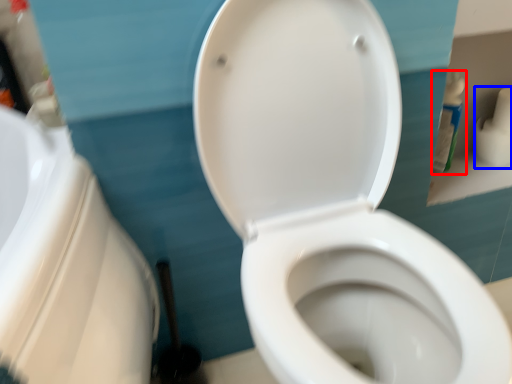
Question: Which object appears farthest to the camera in this image, cleaning product (highlighted by a red box) or toilet paper (highlighted by a blue box)?

Choices:
 (A) cleaning product
 (B) toilet paper

Answer: (B)